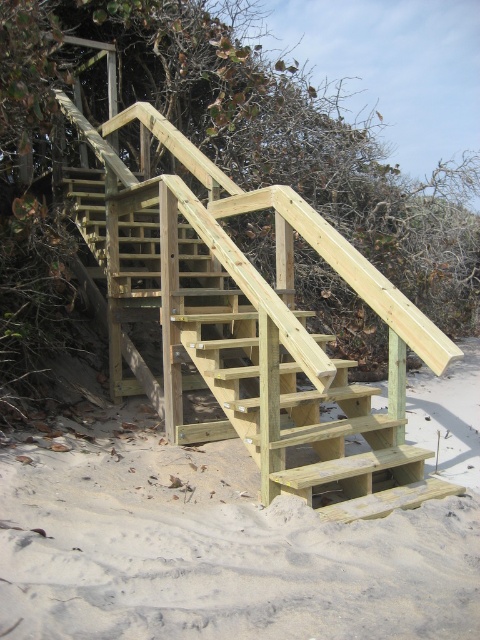
Question: Can you confirm if light brown wood stairs at center is thinner than natural wood stairs at center?

Choices:
 (A) no
 (B) yes

Answer: (B)

Question: Which of the following is the closest to the observer?

Choices:
 (A) light brown wood stairs at center
 (B) natural wood stairs at center

Answer: (A)

Question: Is light brown wood stairs at center wider than natural wood stairs at center?

Choices:
 (A) no
 (B) yes

Answer: (A)

Question: Does light brown wood stairs at center come in front of natural wood stairs at center?

Choices:
 (A) yes
 (B) no

Answer: (A)

Question: Which object is closer to the camera taking this photo?

Choices:
 (A) natural wood stairs at center
 (B) light brown wood stairs at center

Answer: (B)